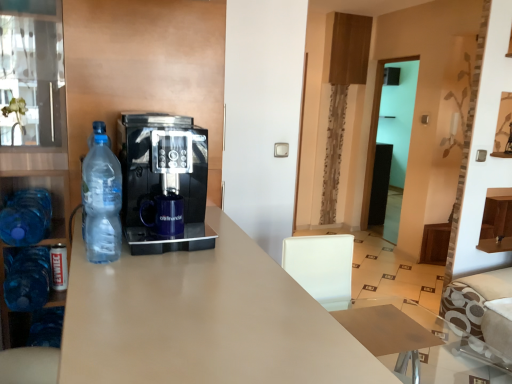
At what (x,y) coordinates should I click in order to perform the action: click on free space to the right of clear plastic bottle at left, marked as the first bottle in a front-to-back arrangement. Please return your answer as a coordinate pair (x, y). This screenshot has width=512, height=384. Looking at the image, I should click on (168, 264).